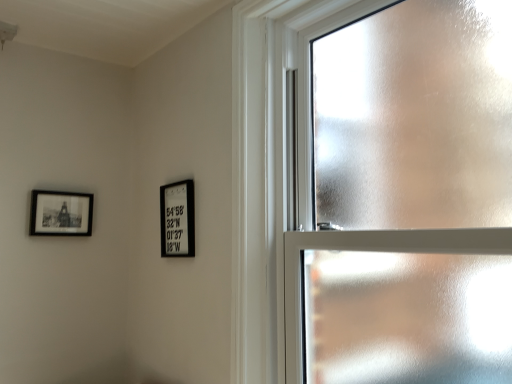
Question: Does point (72, 205) appear closer or farther from the camera than point (165, 230)?

Choices:
 (A) farther
 (B) closer

Answer: (A)

Question: Looking at the image, does matte black picture frame at upper left, placed as the 2th picture frame when sorted from right to left, seem bigger or smaller compared to black matte picture frame at center, the first picture frame viewed from the right?

Choices:
 (A) small
 (B) big

Answer: (A)

Question: Estimate the real-world distances between objects in this image. Which object is closer to the black matte picture frame at center, the first picture frame viewed from the right?

Choices:
 (A) matte black picture frame at upper left, placed as the first picture frame when sorted from left to right
 (B) frosted glass window at upper right

Answer: (A)

Question: Considering the real-world distances, which object is closest to the frosted glass window at upper right?

Choices:
 (A) black matte picture frame at center, the second picture frame in the left-to-right sequence
 (B) matte black picture frame at upper left, placed as the 2th picture frame when sorted from right to left

Answer: (A)